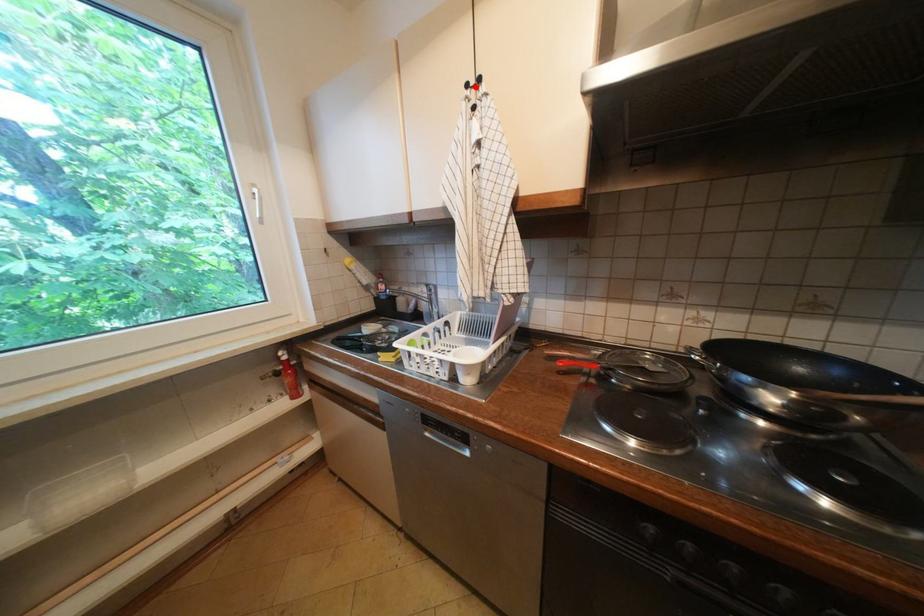
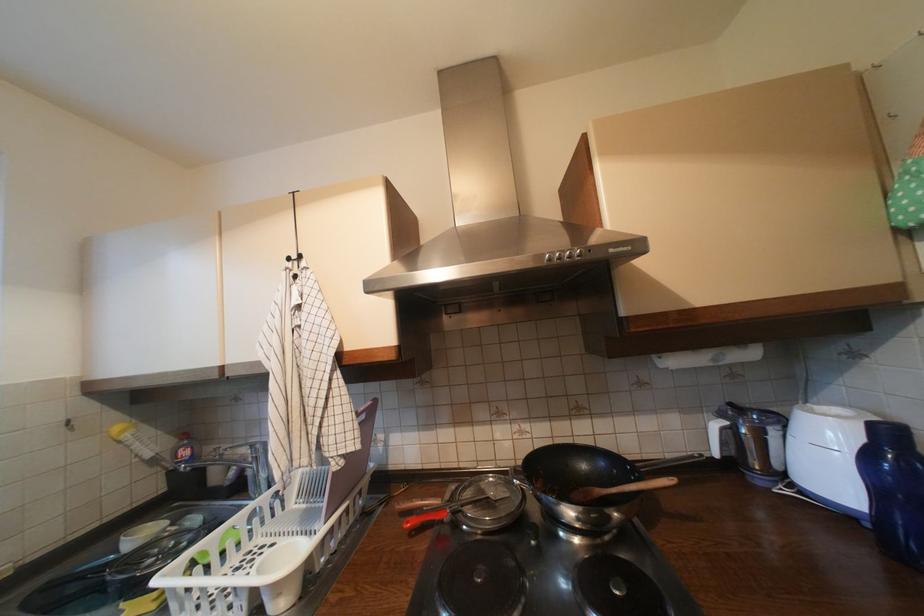
Question: I am providing you with two images of the same scene from different viewpoints. A red point is marked on the first image. Can you still see the location of the red point in image 2?

Choices:
 (A) Yes
 (B) No

Answer: (A)